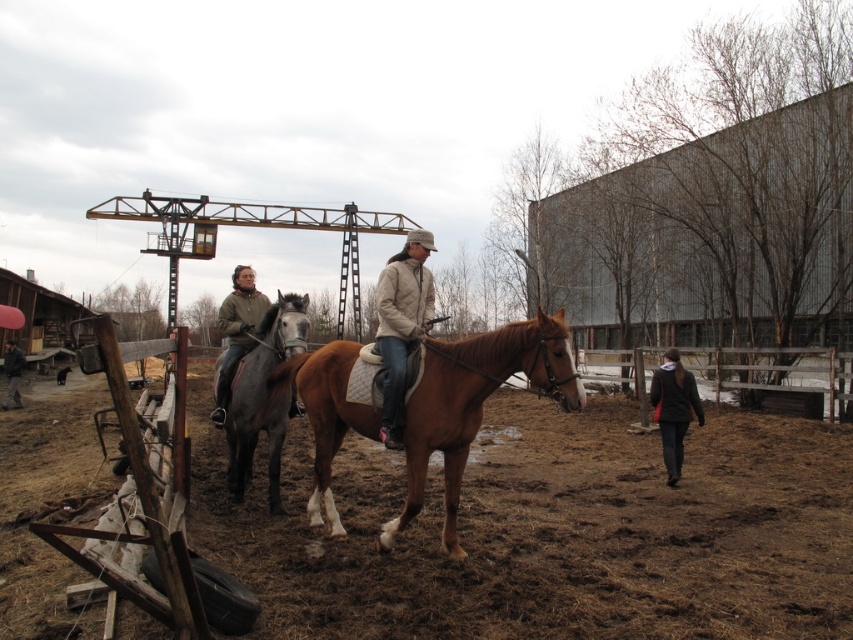
Question: Can you confirm if brown soil at center is positioned to the left of dark brown leather jacket at lower left?

Choices:
 (A) no
 (B) yes

Answer: (A)

Question: Is gray glossy horse at left below dark gray jacket at lower right?

Choices:
 (A) yes
 (B) no

Answer: (B)

Question: Which of the following is the farthest from the observer?

Choices:
 (A) (747, 620)
 (B) (15, 404)
 (C) (231, 292)
 (D) (410, 324)

Answer: (B)

Question: Can you confirm if brown glossy horse at center is smaller than dark brown leather jacket at lower left?

Choices:
 (A) no
 (B) yes

Answer: (B)

Question: Which point is closer to the camera?

Choices:
 (A) beige quilted jacket at center
 (B) brown glossy horse at center

Answer: (B)

Question: Which point appears closest to the camera in this image?

Choices:
 (A) click(250, 321)
 (B) click(689, 413)
 (C) click(468, 392)
 (D) click(386, 266)

Answer: (C)